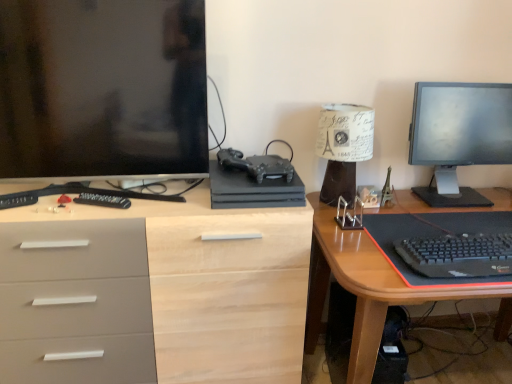
This screenshot has height=384, width=512. I want to click on vacant space underneath white paper lampshade at upper right (from a real-world perspective), so click(336, 202).